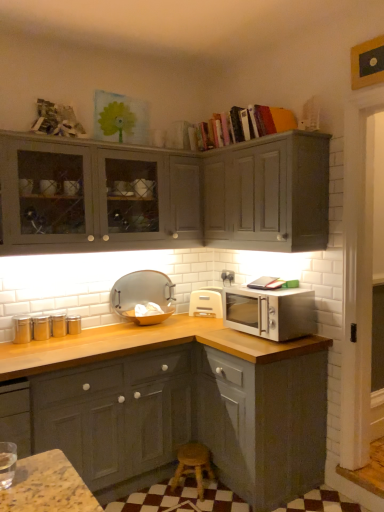
Question: From the image's perspective, is matte silver tray at center, the 1th appliance when ordered from left to right, positioned above or below wooden at lower center?

Choices:
 (A) below
 (B) above

Answer: (B)

Question: From a real-world perspective, is matte silver tray at center, marked as the second appliance in a right-to-left arrangement, positioned above or below wooden at lower center?

Choices:
 (A) below
 (B) above

Answer: (B)

Question: Estimate the real-world distances between objects in this image. Which object is closer to the wooden at lower center?

Choices:
 (A) matte gray cabinets at lower left, the 1th cabinetry from the bottom
 (B) white plastic toaster at lower right, the 1th appliance from the right
 (C) matte gray cabinet at upper right, arranged as the first cabinetry when viewed from the top
 (D) hardcover books at upper center
 (E) matte gray cabinets at upper left, the second cabinetry positioned from the bottom

Answer: (A)

Question: Estimate the real-world distances between objects in this image. Which object is farther from the matte silver tray at center, the 1th appliance when ordered from left to right?

Choices:
 (A) matte gray cabinets at lower left, the 1th cabinetry from the bottom
 (B) satin silver microwave at right
 (C) matte gray cabinets at upper left, the second cabinetry positioned from the bottom
 (D) hardcover books at upper center
 (E) wooden at lower center

Answer: (D)